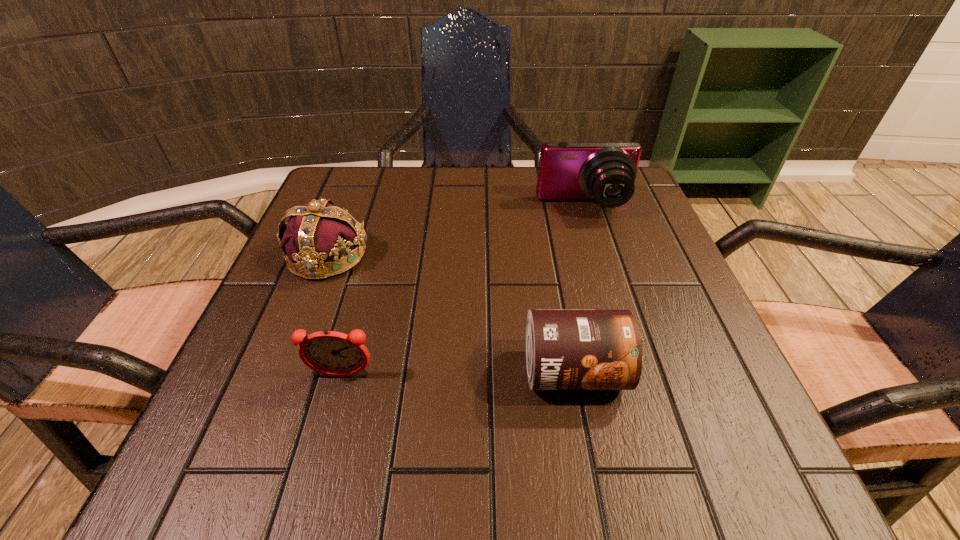
Select which object is the third closest to the third nearest object. Please provide its 2D coordinates. Your answer should be formatted as a tuple, i.e. [(x, y)], where the tuple contains the x and y coordinates of a point satisfying the conditions above.

[(603, 171)]